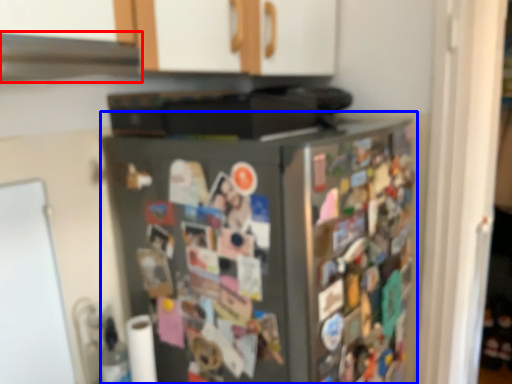
Question: Which object is further to the camera taking this photo, exhaust hood (highlighted by a red box) or refrigerator (highlighted by a blue box)?

Choices:
 (A) exhaust hood
 (B) refrigerator

Answer: (B)